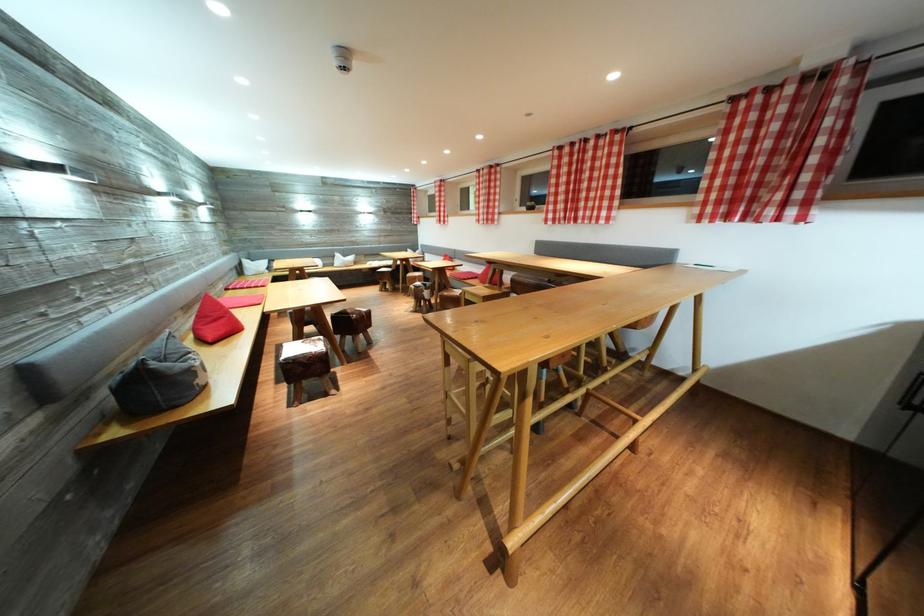
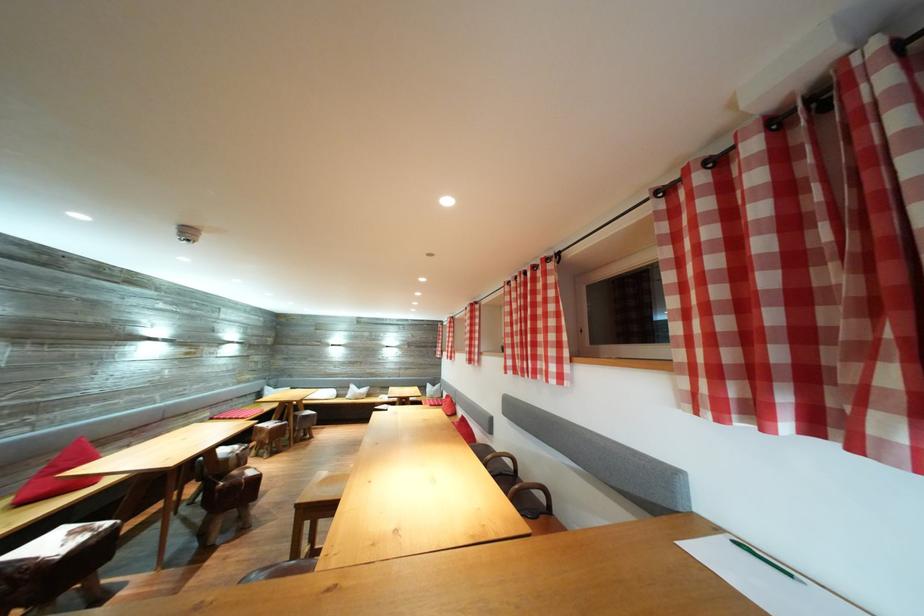
Where in the second image is the point corresponding to (x=345, y=261) from the first image?

(359, 392)